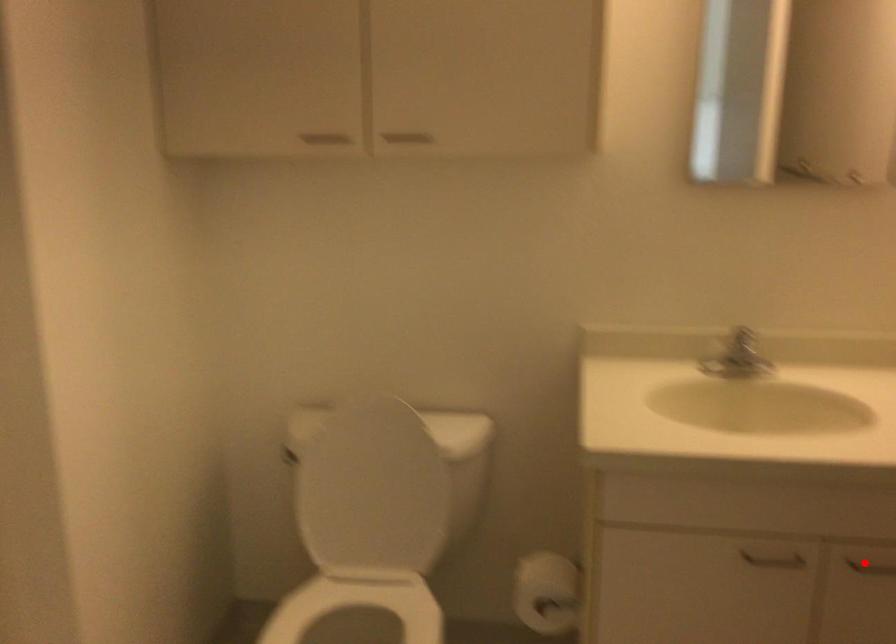
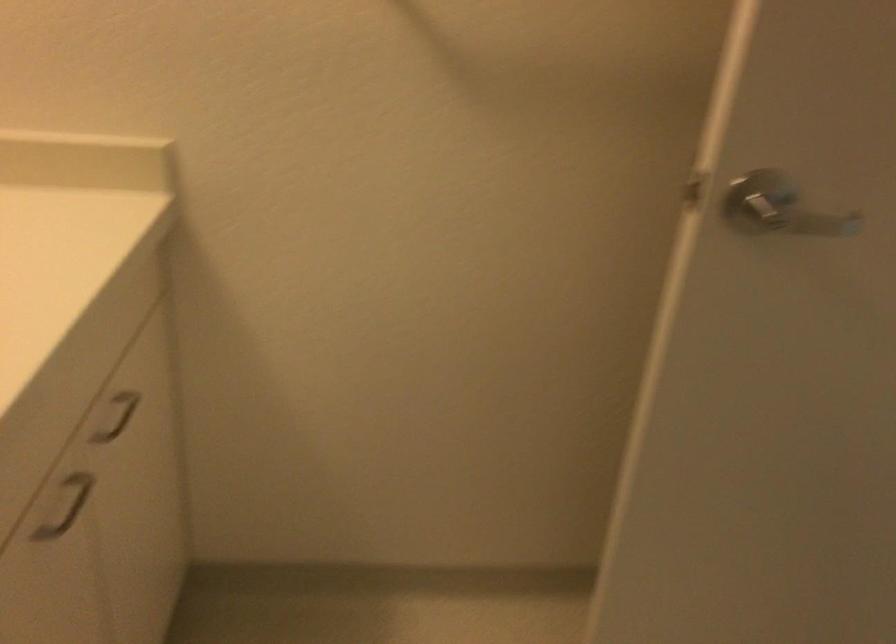
Question: I am providing you with two images of the same scene from different viewpoints. A red point is marked on the first image. Can you still see the location of the red point in image 2?

Choices:
 (A) Yes
 (B) No

Answer: (B)